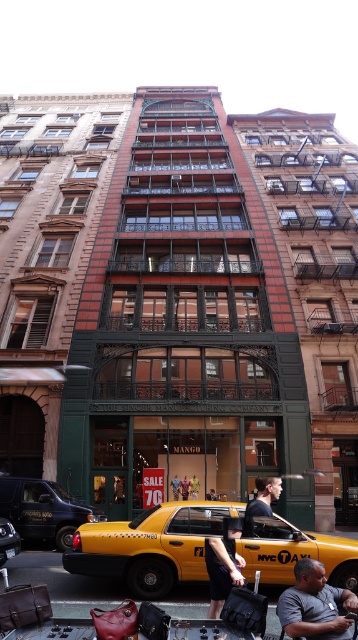
Consider the image. You are a delivery person who needs to place a package on top of the yellow matte taxi at center and the smooth leather handbags at lower center. Which object can you place the package on without it falling off?

The yellow matte taxi at center is much taller than the smooth leather handbags at lower center, so placing the package on the yellow matte taxi at center would be more stable and less likely to fall off.

Based on the photo, you are a delivery person who needs to deliver a package to the Mango clothing store. You see a yellow matte taxi at center and smooth leather handbags at lower center. Which object is narrower, and why is this important for navigating to the store?

The yellow matte taxi at center is narrower than the smooth leather handbags at lower center. This is important because the narrower taxi might allow easier passage to reach the store entrance without obstruction.